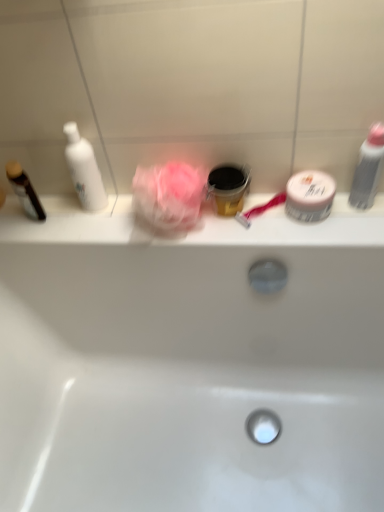
Where is `vacant space in front of white glossy bottle at left`? Image resolution: width=384 pixels, height=512 pixels. vacant space in front of white glossy bottle at left is located at coordinates (94, 230).